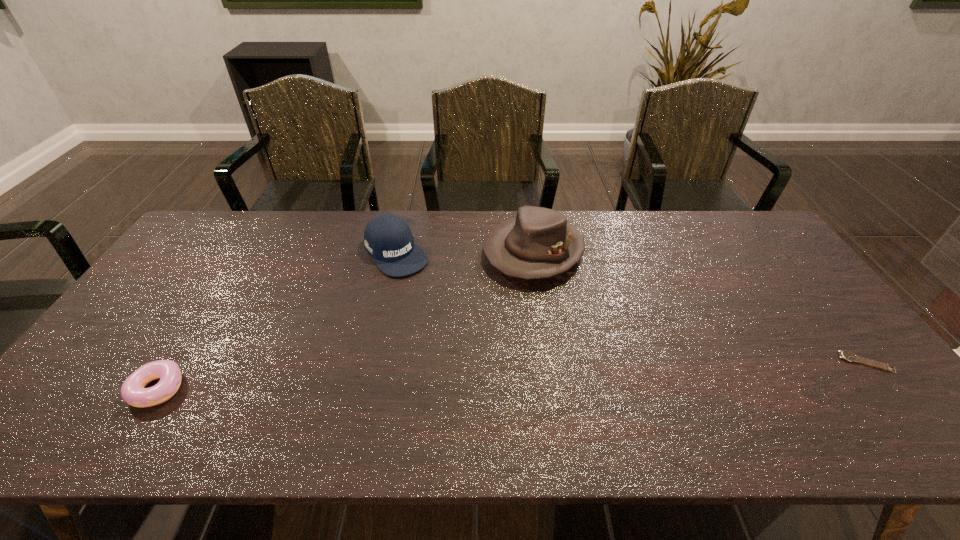
Locate an element on the screen. The image size is (960, 540). object at the left edge is located at coordinates (133, 392).

This screenshot has height=540, width=960. What are the coordinates of `object that is positioned at the right edge` in the screenshot? It's located at (846, 355).

At what (x,y) coordinates should I click in order to perform the action: click on object located at the near left corner. Please return your answer as a coordinate pair (x, y). The width and height of the screenshot is (960, 540). Looking at the image, I should click on click(x=133, y=392).

Locate an element on the screen. object located at the near right corner is located at coordinates (846, 355).

In the image, there is a desktop. At what (x,y) coordinates should I click in order to perform the action: click on vacant space at the far edge. Please return your answer as a coordinate pair (x, y). Looking at the image, I should click on (291, 240).

This screenshot has height=540, width=960. In order to click on vacant region at the near edge in this screenshot , I will do `click(188, 384)`.

Identify the location of blank space at the left edge. This screenshot has height=540, width=960. (163, 288).

You are a GUI agent. You are given a task and a screenshot of the screen. Output one action in this format:
    pyautogui.click(x=<x>, y=<y>)
    Task: Click on the free space at the right edge of the desktop
    The width and height of the screenshot is (960, 540).
    Given the screenshot: What is the action you would take?
    [828, 319]

Identify the location of vacant space at the far left corner. (223, 233).

The height and width of the screenshot is (540, 960). What are the coordinates of `free space at the far right corner of the desktop` in the screenshot? It's located at (708, 212).